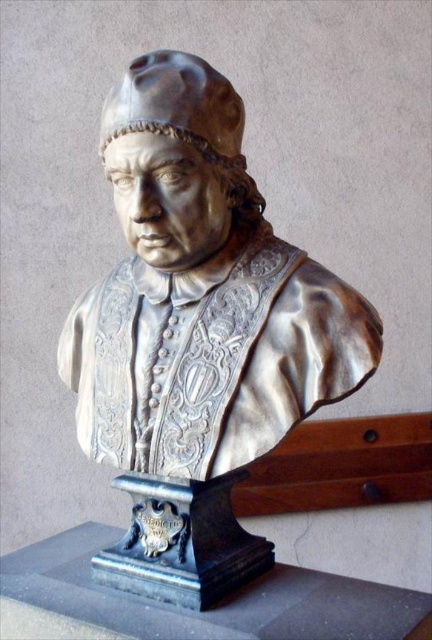
You are an art conservator standing 1 meter away from the shiny bronze bust at center. Can you reach the bust to clean it without moving your position?

The shiny bronze bust at center is 38.43 inches from the viewer. Since 38.43 inches is approximately 0.98 meters, which is slightly less than 1 meter, you are standing slightly farther away. Therefore, you cannot reach the bust to clean it without moving closer.

You are standing in front of a statue and want to take a photo of the shiny bronze bust at center. Where should you position your camera to capture it perfectly?

The shiny bronze bust at center is located at point coordinates of (197, 333), so you should position your camera directly facing that point to capture it perfectly.